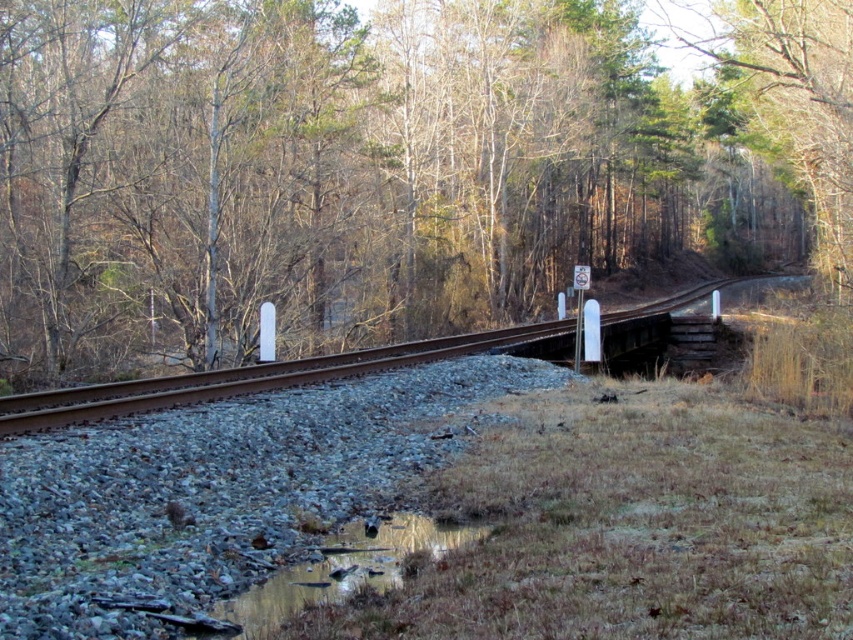
Question: Which object is closer to the camera taking this photo?

Choices:
 (A) brown wood tree at center
 (B) reflective wet grass at lower center

Answer: (B)

Question: Can you confirm if brown wood tree at center is thinner than brown metal train track at center?

Choices:
 (A) no
 (B) yes

Answer: (A)

Question: Which object appears farthest from the camera in this image?

Choices:
 (A) brown wood tree at center
 (B) brown metal train track at center

Answer: (A)

Question: Which point is farther to the camera?

Choices:
 (A) reflective wet grass at lower center
 (B) brown metal train track at center
 (C) brown wood tree at center

Answer: (C)

Question: Does brown metal train track at center have a smaller size compared to reflective wet grass at lower center?

Choices:
 (A) no
 (B) yes

Answer: (A)

Question: Does brown wood tree at center have a lesser width compared to reflective wet grass at lower center?

Choices:
 (A) yes
 (B) no

Answer: (B)